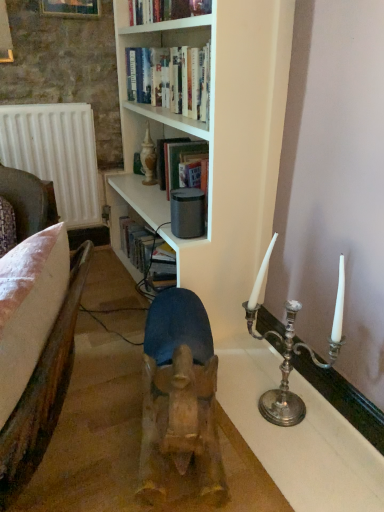
What is the approximate width of silver metallic candle holder at right?

It is 19.33 centimeters.

Describe the element at coordinates (71, 8) in the screenshot. The height and width of the screenshot is (512, 384). I see `wooden frame at upper left` at that location.

You are a GUI agent. You are given a task and a screenshot of the screen. Output one action in this format:
    pyautogui.click(x=<x>, y=<y>)
    Task: Click on the white matte bookshelf at upper center
    This screenshot has width=384, height=512.
    Given the screenshot: What is the action you would take?
    pyautogui.click(x=219, y=144)

The height and width of the screenshot is (512, 384). Describe the element at coordinates (165, 10) in the screenshot. I see `hardcover book at upper center` at that location.

The width and height of the screenshot is (384, 512). I want to click on brown leather armchair at left, so click(x=42, y=392).

Does white matte radiator at left have a larger size compared to hardcover book at upper center?

Correct, white matte radiator at left is larger in size than hardcover book at upper center.

Is point (75, 141) positioned after point (209, 2)?

Yes, point (75, 141) is behind point (209, 2).

You are a GUI agent. You are given a task and a screenshot of the screen. Output one action in this format:
    pyautogui.click(x=<x>, y=<y>)
    Task: Click on the radiator on the left of hardcover book at upper center
    
    Given the screenshot: What is the action you would take?
    pyautogui.click(x=56, y=154)

From the image's perspective, relative to hardcover book at upper center, is white matte radiator at left above or below?

white matte radiator at left is situated lower than hardcover book at upper center in the image.

Is white matte bookshelf at upper center positioned beyond the bounds of hardcover book at upper center?

Yes, white matte bookshelf at upper center is located beyond the bounds of hardcover book at upper center.

From their relative heights in the image, would you say white matte bookshelf at upper center is taller or shorter than hardcover book at upper center?

In the image, white matte bookshelf at upper center appears to be taller than hardcover book at upper center.

Is white matte bookshelf at upper center bigger than hardcover book at upper center?

Indeed, white matte bookshelf at upper center has a larger size compared to hardcover book at upper center.

From a real-world perspective, is white matte bookshelf at upper center physically located above or below hardcover book at upper center?

white matte bookshelf at upper center is below hardcover book at upper center.

Is silver metallic candle holder at right facing away from white matte radiator at left?

No, silver metallic candle holder at right is not facing the opposite direction of white matte radiator at left.

Consider the image. Based on their sizes in the image, would you say silver metallic candle holder at right is bigger or smaller than white matte radiator at left?

Clearly, silver metallic candle holder at right is larger in size than white matte radiator at left.

From the image's perspective, between silver metallic candle holder at right and white matte radiator at left, who is located below?

silver metallic candle holder at right appears lower in the image.

From a real-world perspective, is brown leather armchair at left physically above silver metallic candle holder at right?

Yes.

Can you tell me how much brown leather armchair at left and silver metallic candle holder at right differ in facing direction?

17.1 degrees separate the facing orientations of brown leather armchair at left and silver metallic candle holder at right.

Locate an element on the screen. armchair that is above the silver metallic candle holder at right (from the image's perspective) is located at coordinates (42, 392).

Between brown leather armchair at left and silver metallic candle holder at right, which one has smaller width?

silver metallic candle holder at right.

Is hardcover book at upper center behind wooden frame at upper left?

No.

Choose the correct answer: Is hardcover book at upper center inside wooden frame at upper left or outside it?

hardcover book at upper center is not inside wooden frame at upper left, it's outside.

Is hardcover book at upper center turned away from wooden frame at upper left?

No, wooden frame at upper left is not at the back of hardcover book at upper center.

Does point (165, 2) come closer to viewer compared to point (62, 15)?

That is True.

Is white matte radiator at left wider or thinner than silver metallic candle holder at right?

Considering their sizes, white matte radiator at left looks slimmer than silver metallic candle holder at right.

Is white matte radiator at left positioned beyond the bounds of silver metallic candle holder at right?

Yes, white matte radiator at left is located beyond the bounds of silver metallic candle holder at right.

Does point (52, 121) come behind point (297, 310)?

Yes, it is.

From the picture: Between wooden frame at upper left and silver metallic candle holder at right, which one appears on the right side from the viewer's perspective?

silver metallic candle holder at right.

Is silver metallic candle holder at right at the back of wooden frame at upper left?

No, wooden frame at upper left is not facing the opposite direction of silver metallic candle holder at right.

Considering the sizes of objects wooden frame at upper left and silver metallic candle holder at right in the image provided, who is smaller, wooden frame at upper left or silver metallic candle holder at right?

Smaller between the two is wooden frame at upper left.

Is wooden frame at upper left not close to silver metallic candle holder at right?

Yes, wooden frame at upper left and silver metallic candle holder at right are quite far apart.

In the image, there is a hardcover book at upper center. Where is `radiator below it (from a real-world perspective)`? This screenshot has width=384, height=512. radiator below it (from a real-world perspective) is located at coordinates (56, 154).

Find the location of a particular element. This screenshot has height=512, width=384. book above the white matte bookshelf at upper center (from a real-world perspective) is located at coordinates (165, 10).

Based on their spatial positions, is brown leather armchair at left or wooden frame at upper left closer to silver metallic candle holder at right?

brown leather armchair at left lies closer to silver metallic candle holder at right than the other object.

Based on their spatial positions, is white matte bookshelf at upper center or brown leather armchair at left closer to hardcover book at upper center?

white matte bookshelf at upper center.

Which object lies further to the anchor point wooden frame at upper left, white matte radiator at left or hardcover book at upper center?

Based on the image, white matte radiator at left appears to be further to wooden frame at upper left.

Which object lies nearer to the anchor point brown leather armchair at left, white matte radiator at left or wooden frame at upper left?

white matte radiator at left.

When comparing their distances from white matte bookshelf at upper center, does silver metallic candle holder at right or brown leather armchair at left seem closer?

silver metallic candle holder at right is closer to white matte bookshelf at upper center.

Based on their spatial positions, is white matte bookshelf at upper center or brown leather armchair at left further from wooden frame at upper left?

Based on the image, brown leather armchair at left appears to be further to wooden frame at upper left.

From the image, which object appears to be nearer to hardcover book at upper center, white matte bookshelf at upper center or white matte radiator at left?

white matte bookshelf at upper center.

Looking at the image, which one is located further to silver metallic candle holder at right, white matte radiator at left or hardcover book at upper center?

white matte radiator at left is further to silver metallic candle holder at right.

In order to click on bookcase located between brown leather armchair at left and white matte radiator at left in the depth direction in this screenshot , I will do [219, 144].

The width and height of the screenshot is (384, 512). Find the location of `picture frame positioned between brown leather armchair at left and white matte radiator at left from near to far`. picture frame positioned between brown leather armchair at left and white matte radiator at left from near to far is located at coordinates (71, 8).

Find the location of `book between white matte bookshelf at upper center and white matte radiator at left from front to back`. book between white matte bookshelf at upper center and white matte radiator at left from front to back is located at coordinates (165, 10).

Locate an element on the screen. book between wooden frame at upper left and silver metallic candle holder at right from top to bottom is located at coordinates (165, 10).